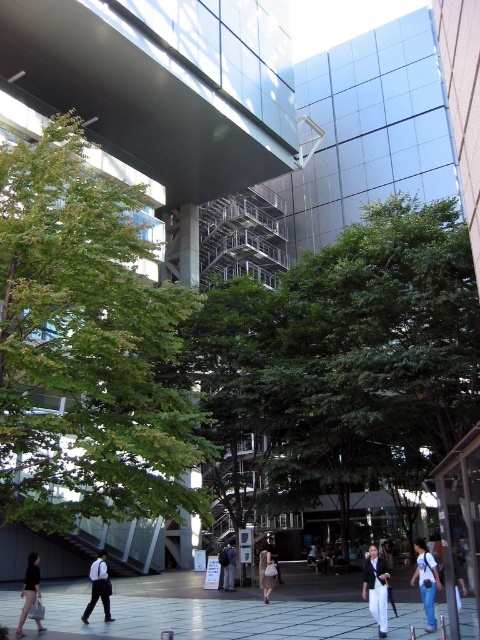
You are a delivery person who needs to place a package on the ground. You see the green leafy tree at center and the dark gray fabric bag at lower left. Which object is taller, and can you place the package between them without it being hidden?

The green leafy tree at center is taller than the dark gray fabric bag at lower left. Since the tree is taller, placing the package between them might still allow visibility as the bag is shorter, but ensure the space between them is wide enough for the package.

You are standing at the center of the paved area in the foreground. Which direction should you walk to reach the green leafy tree at left?

The green leafy tree at left is located at point (x=86, y=348), so you should walk to the left to reach it.